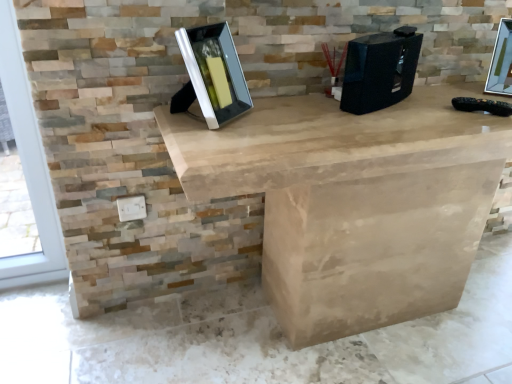
Question: From a real-world perspective, is black plastic desktop computer at center above or below metallic silver picture frame at upper right, the first picture frame when ordered from back to front?

Choices:
 (A) below
 (B) above

Answer: (A)

Question: From the image's perspective, is black plastic desktop computer at center above or below metallic silver picture frame at upper right, the first picture frame when ordered from back to front?

Choices:
 (A) above
 (B) below

Answer: (B)

Question: Which object is the farthest from the matte black picture frame at center, which is the first picture frame from front to back?

Choices:
 (A) metallic silver picture frame at upper right, which is counted as the 2th picture frame, starting from the front
 (B) black plastic desktop computer at center

Answer: (A)

Question: Considering the real-world distances, which object is farthest from the metallic silver picture frame at upper right, which is the first picture frame from right to left?

Choices:
 (A) matte black picture frame at center, which is the first picture frame from front to back
 (B) black plastic desktop computer at center

Answer: (A)